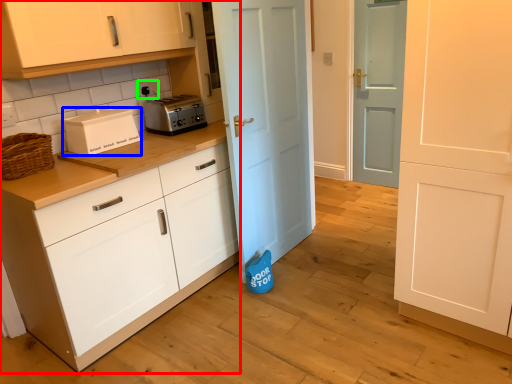
Question: Estimate the real-world distances between objects in this image. Which object is farther from cabinetry (highlighted by a red box), home appliance (highlighted by a blue box) or electric outlet (highlighted by a green box)?

Choices:
 (A) home appliance
 (B) electric outlet

Answer: (B)